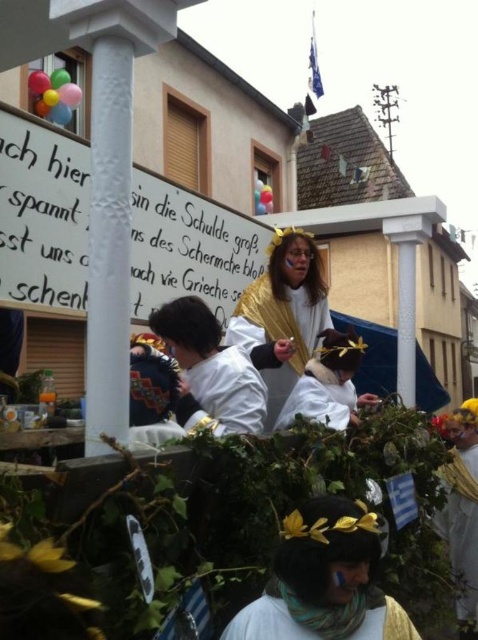
Question: Which object is farther from the camera taking this photo?

Choices:
 (A) gold metallic cape at center
 (B) white matte costume at center

Answer: (A)

Question: Which point is farther from the camera taking this photo?

Choices:
 (A) click(283, 396)
 (B) click(302, 388)

Answer: (A)

Question: Which is farther from the white fabric headband at center?

Choices:
 (A) gold metallic cape at center
 (B) white matte costume at center

Answer: (A)

Question: Is gold metallic cape at center closer to camera compared to white fabric headband at center?

Choices:
 (A) yes
 (B) no

Answer: (B)

Question: Can you confirm if white fabric headband at center is smaller than white matte costume at center?

Choices:
 (A) no
 (B) yes

Answer: (B)

Question: Is gold metallic cape at center positioned at the back of white fabric headband at center?

Choices:
 (A) no
 (B) yes

Answer: (B)